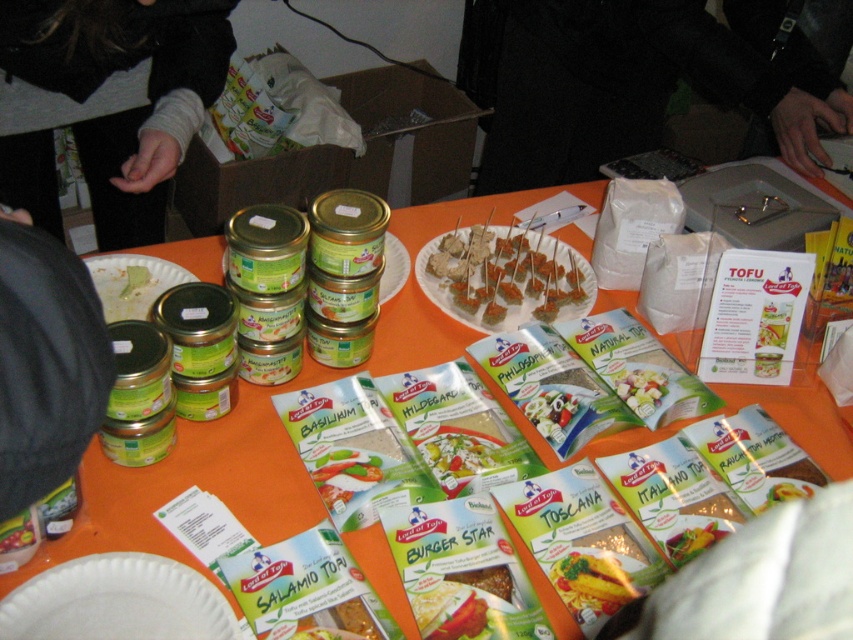
You are a guest at a food tasting event and see the white paper plate at lower left and the yellow matte pasta at center. Which item is placed on top of the other?

The white paper plate at lower left is positioned over the yellow matte pasta at center, so the white paper plate at lower left is on top.